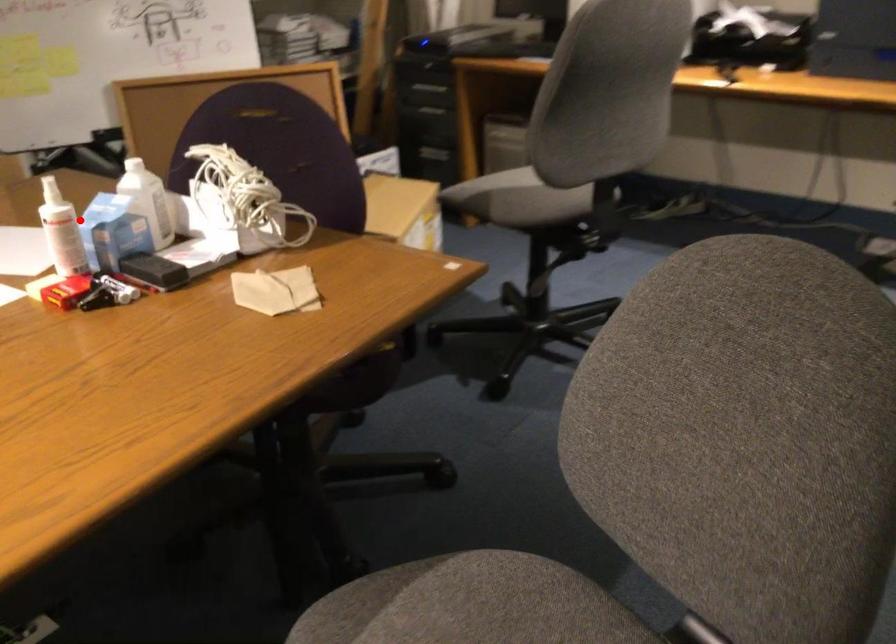
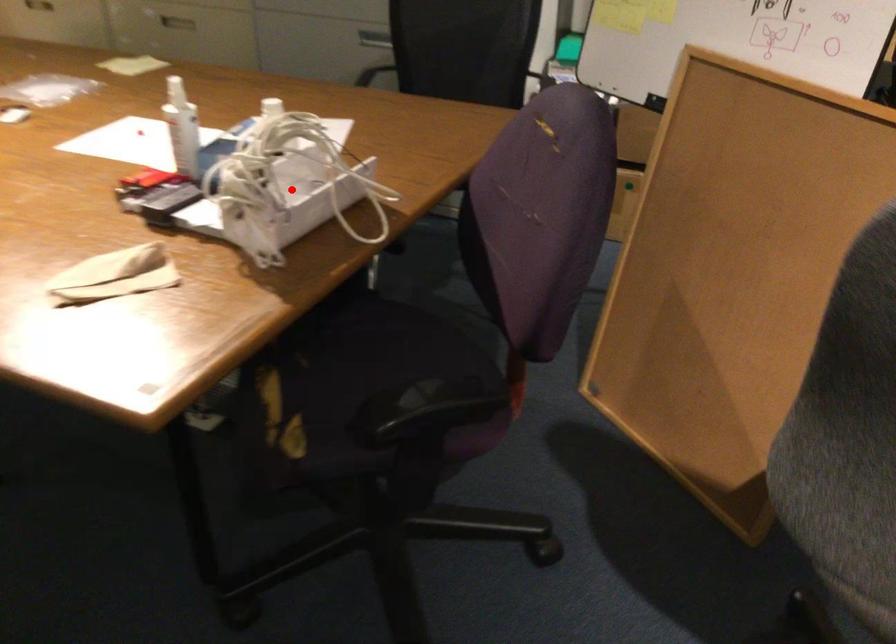
From the picture: I am providing you with two images of the same scene from different viewpoints. A red point is marked on the first image and another point is marked on the second image. Is the red point in image1 aligned with the point shown in image2?

No